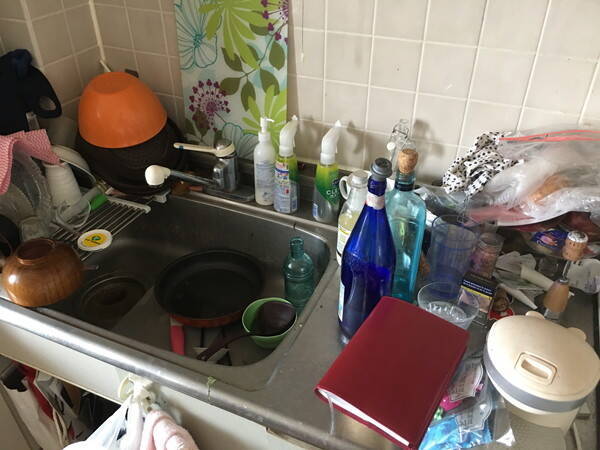
Find the location of a particular element. faucet is located at coordinates (220, 172).